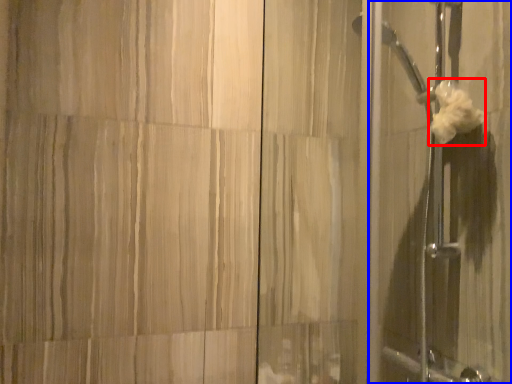
Question: Among these objects, which one is nearest to the camera, flower (highlighted by a red box) or screen door (highlighted by a blue box)?

Choices:
 (A) flower
 (B) screen door

Answer: (B)